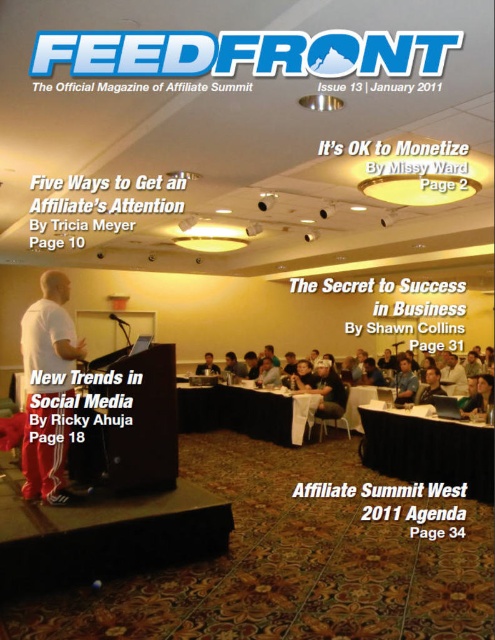
Can you confirm if white tablecloth at center is wider than light brown wooden table at center?

Yes, white tablecloth at center is wider than light brown wooden table at center.

Can you confirm if white tablecloth at center is smaller than light brown wooden table at center?

Actually, white tablecloth at center might be larger than light brown wooden table at center.

Does point (187, 422) come behind point (208, 353)?

That is False.

Identify the location of white tablecloth at center. (244, 412).

Is point (33, 321) more distant than point (211, 355)?

No, (33, 321) is closer to viewer.

Which of these two, white matte shirt at center or light brown wooden table at center, stands shorter?

light brown wooden table at center is shorter.

Which is behind, point (33, 461) or point (205, 365)?

Point (205, 365)

In order to click on white matte shirt at center in this screenshot , I will do `click(48, 388)`.

Does black fabric table at center have a smaller size compared to light brown leather jacket at center?

No.

Is black fabric table at center shorter than light brown leather jacket at center?

Yes, black fabric table at center is shorter than light brown leather jacket at center.

Which is behind, point (442, 445) or point (328, 371)?

Point (328, 371)

Find the location of a particular element. This screenshot has height=640, width=495. black fabric table at center is located at coordinates (429, 451).